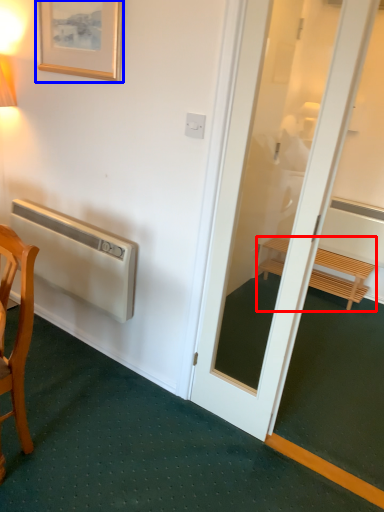
Question: Which of the following is the closest to the observer, furniture (highlighted by a red box) or picture frame (highlighted by a blue box)?

Choices:
 (A) furniture
 (B) picture frame

Answer: (B)